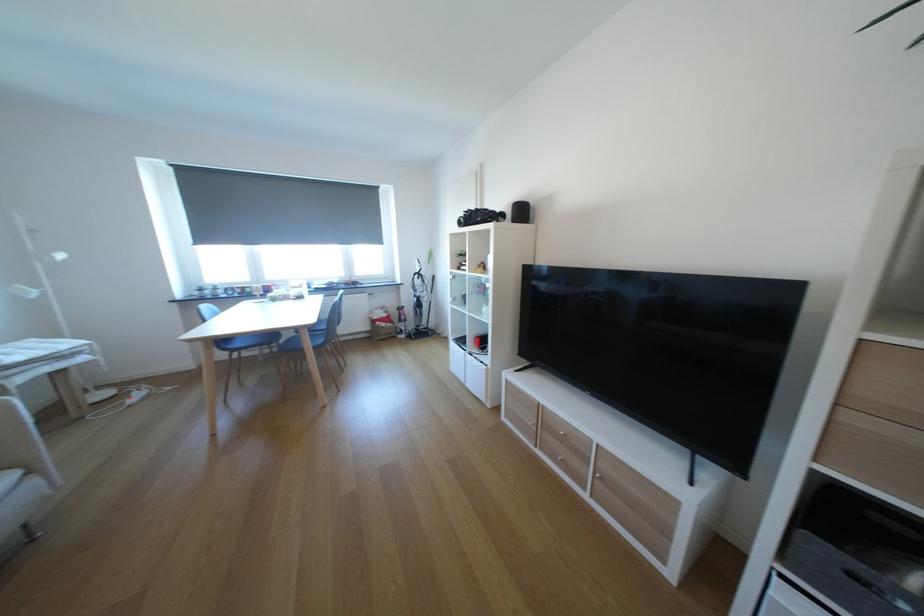
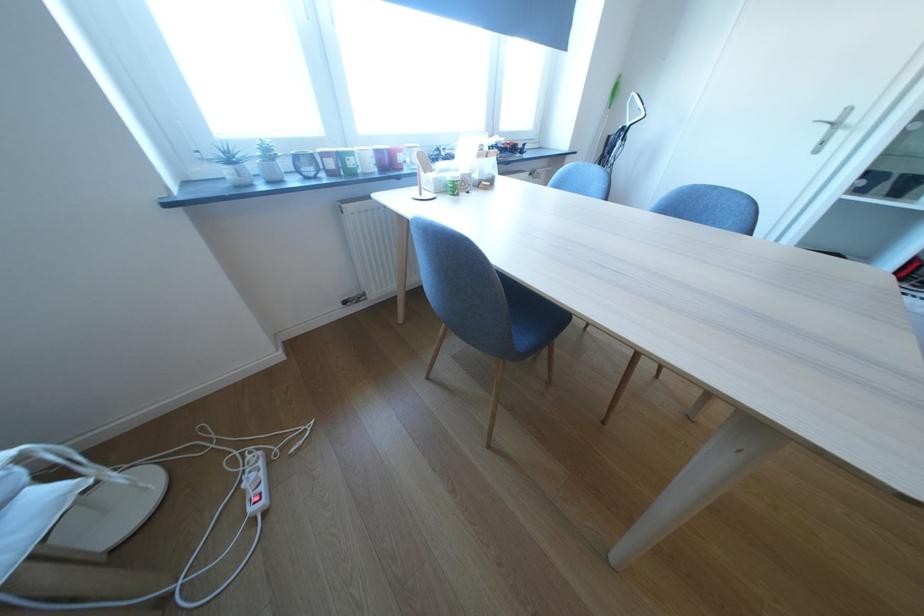
Find the pixel in the second image that matches (237,291) in the first image.

(308, 160)